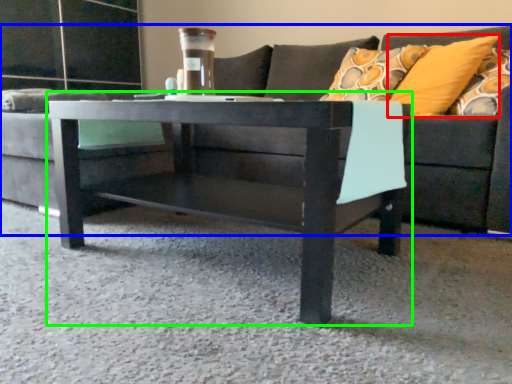
Question: Which object is positioned farthest from pillow (highlighted by a red box)? Select from studio couch (highlighted by a blue box) and coffee table (highlighted by a green box).

Choices:
 (A) studio couch
 (B) coffee table

Answer: (B)